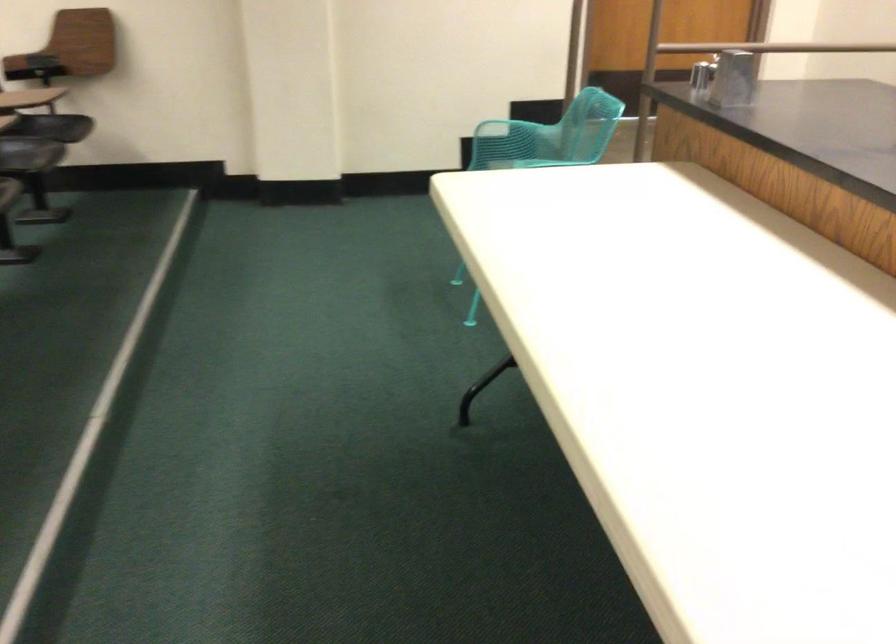
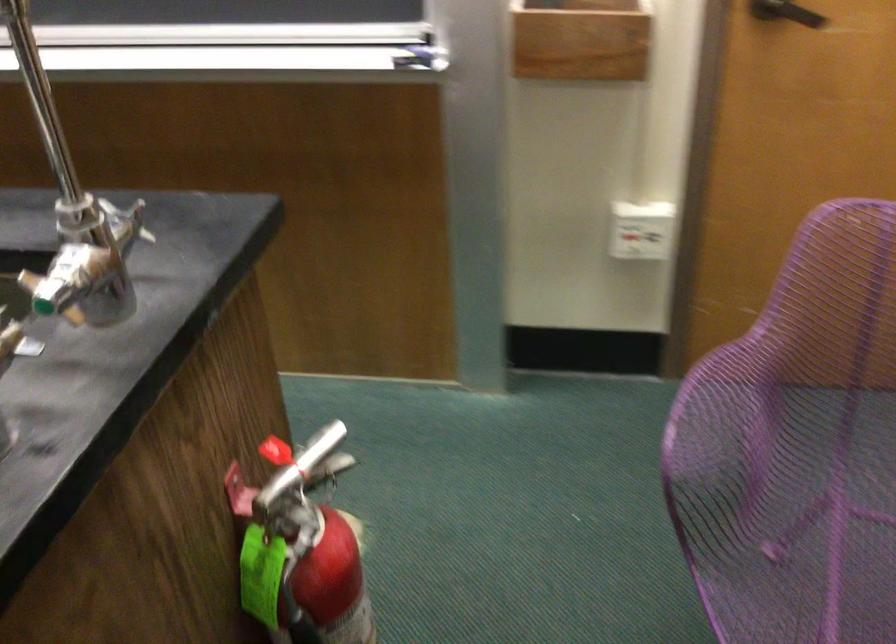
The images are taken continuously from a first-person perspective. In which direction is your viewpoint rotating?

The rotation direction of the camera is right-down.